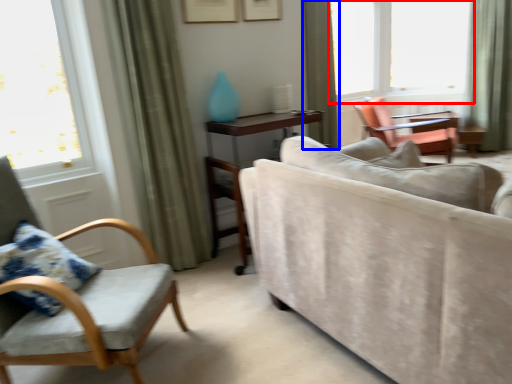
Question: Which object is closer to the camera taking this photo, window (highlighted by a red box) or curtain (highlighted by a blue box)?

Choices:
 (A) window
 (B) curtain

Answer: (B)